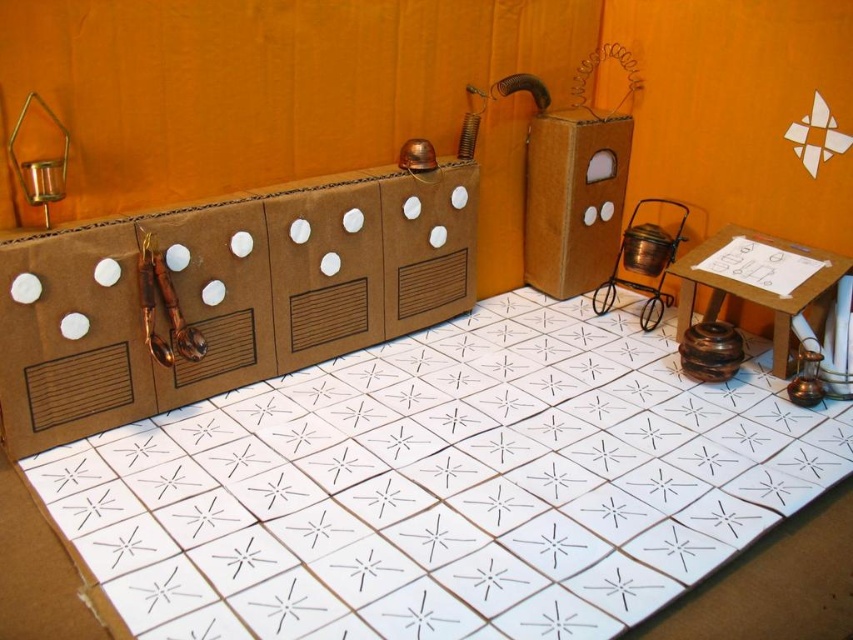
Is white cardboard floor at center positioned in front of brown cardboard box at center?

Yes.

Which of these two, white cardboard floor at center or brown cardboard box at center, stands taller?

Standing taller between the two is brown cardboard box at center.

Is point (355, 568) positioned behind point (358, 289)?

That is False.

I want to click on white cardboard floor at center, so click(x=444, y=486).

Which is in front, point (231, 349) or point (62, 196)?

Point (62, 196)

Consider the image. How much distance is there between brown cardboard box at center and metallic candlestick at left?

brown cardboard box at center is 14.49 inches from metallic candlestick at left.

Is point (241, 340) positioned behind point (39, 182)?

Yes, point (241, 340) is behind point (39, 182).

This screenshot has height=640, width=853. Identify the location of brown cardboard box at center. (224, 296).

Does white cardboard floor at center have a greater height compared to metallic candlestick at left?

Yes.

Who is shorter, white cardboard floor at center or metallic candlestick at left?

Standing shorter between the two is metallic candlestick at left.

Identify the location of white cardboard floor at center. The image size is (853, 640). (444, 486).